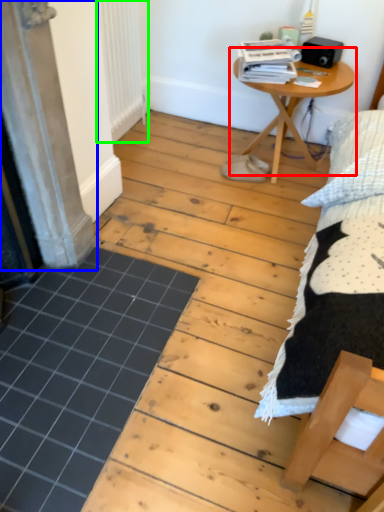
Question: Which object is the farthest from table (highlighted by a red box)? Choose among these: screen door (highlighted by a blue box) or radiator (highlighted by a green box).

Choices:
 (A) screen door
 (B) radiator

Answer: (A)